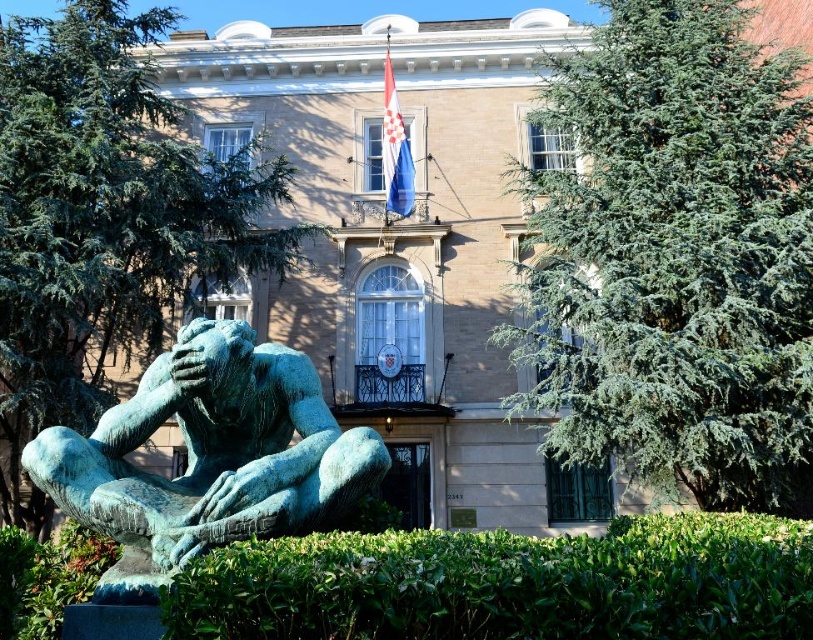
You are standing in front of the two story building and want to place a new flowerpot exactly at the point marked as point (507,582). What object is currently located at that point?

The green leafy bush at lower center is located at point (507,582).

You are standing at the entrance of the two story building and see two points marked on the ground. The first point is at coordinate point (x=772, y=97) and the second is at point (x=155, y=122). Which point is closer to you?

Point (x=772, y=97) is in front of point (x=155, y=122), so it is closer to you.